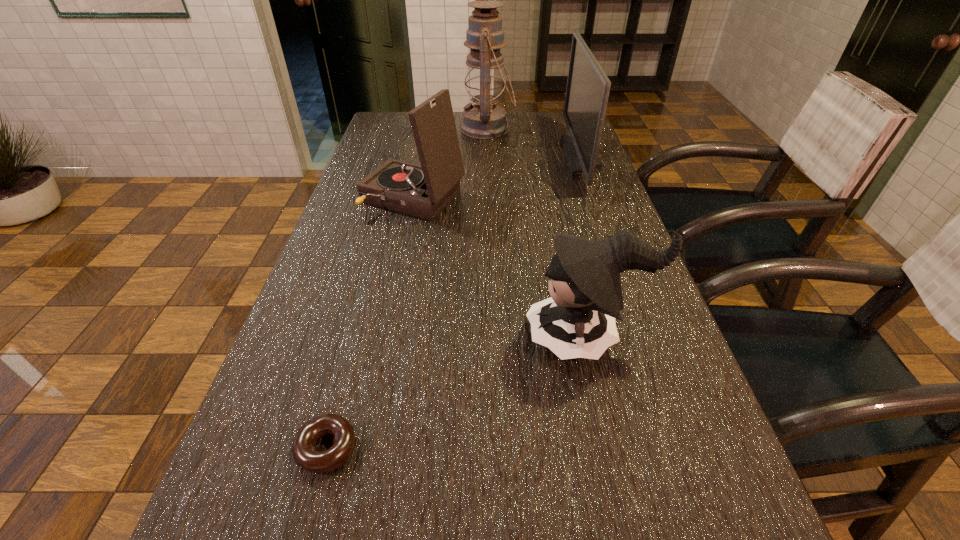
The image size is (960, 540). Identify the location of oil lamp. (485, 79).

This screenshot has height=540, width=960. I want to click on monitor, so click(x=587, y=92).

Where is `phonograph record`? This screenshot has width=960, height=540. phonograph record is located at coordinates (423, 191).

The image size is (960, 540). Find the location of `the second nearest object`. the second nearest object is located at coordinates (578, 321).

This screenshot has width=960, height=540. Find the location of `doughnut`. doughnut is located at coordinates (305, 455).

This screenshot has width=960, height=540. I want to click on the shortest object, so click(x=305, y=455).

Locate an element on the screen. The height and width of the screenshot is (540, 960). blank area located on the right of the tallest object is located at coordinates (534, 129).

Where is `free space located 0.120m on the screen side of the monitor`? free space located 0.120m on the screen side of the monitor is located at coordinates (529, 157).

Locate an element on the screen. The image size is (960, 540). vacant space situated on the screen side of the monitor is located at coordinates 476,157.

The image size is (960, 540). In order to click on free space located on the screen side of the monitor in this screenshot , I will do `click(522, 157)`.